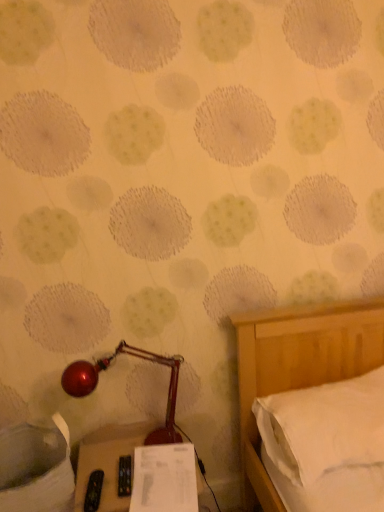
Question: Is white soft pillow at right wider or thinner than white paper at lower center?

Choices:
 (A) thin
 (B) wide

Answer: (B)

Question: Is white soft pillow at right situated inside white paper at lower center or outside?

Choices:
 (A) outside
 (B) inside

Answer: (A)

Question: Which is farther from the white soft pillow at right?

Choices:
 (A) shiny red lamp at lower left
 (B) black plastic remote control at lower center
 (C) white paper at lower center

Answer: (B)

Question: Which is farther from the black plastic remote control at lower center?

Choices:
 (A) white soft pillow at right
 (B) white paper at lower center
 (C) shiny red lamp at lower left

Answer: (A)